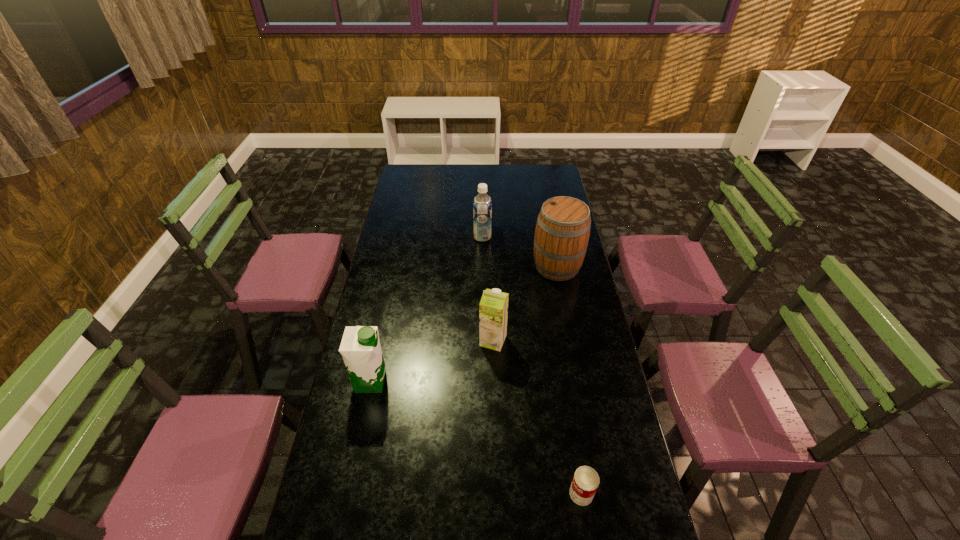
Where is `free space between the third nearest object and the farthest object`? free space between the third nearest object and the farthest object is located at coordinates (488, 289).

I want to click on free space that is in between the second farthest object and the leftmost soya milk, so click(x=464, y=324).

Where is `the third closest object to the second farthest object`? The image size is (960, 540). the third closest object to the second farthest object is located at coordinates (360, 347).

This screenshot has height=540, width=960. I want to click on object that stands as the fourth closest to the second farthest soya milk, so click(x=482, y=204).

Select which soya milk appears as the second closest to the third nearest object. Please provide its 2D coordinates. Your answer should be formatted as a tuple, i.e. [(x, y)], where the tuple contains the x and y coordinates of a point satisfying the conditions above.

[(482, 204)]

I want to click on soya milk object that ranks as the closest to the leftmost soya milk, so click(493, 309).

You are a GUI agent. You are given a task and a screenshot of the screen. Output one action in this format:
    pyautogui.click(x=<x>, y=<y>)
    Task: Click on the vacant area that satisfies the following two spatial constraints: 1. on the front side of the second farthest soya milk; 2. on the front-facing side of the leftmost object
    This screenshot has height=540, width=960.
    Given the screenshot: What is the action you would take?
    pyautogui.click(x=494, y=382)

At what (x,y) coordinates should I click in order to perform the action: click on free region that satisfies the following two spatial constraints: 1. on the front side of the second farthest object; 2. on the front-facing side of the nearest soya milk. Please return your answer as a coordinate pair (x, y). Looking at the image, I should click on (579, 382).

Where is `vacant region that satisfies the following two spatial constraints: 1. on the back side of the second nearest soya milk; 2. on the label of the farthest object`? vacant region that satisfies the following two spatial constraints: 1. on the back side of the second nearest soya milk; 2. on the label of the farthest object is located at coordinates click(x=491, y=237).